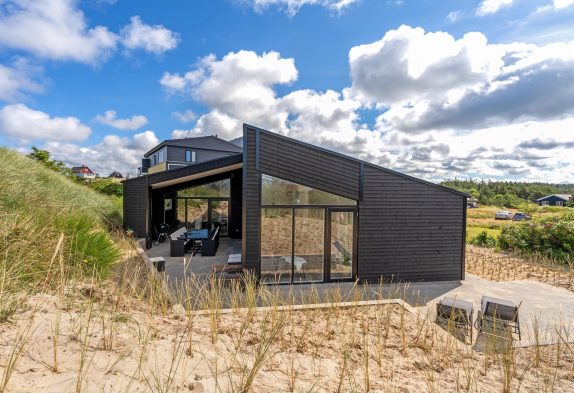
You are a GUI agent. You are given a task and a screenshot of the screen. Output one action in this format:
    pyautogui.click(x=<x>, y=<y>)
    Task: Click on the bench
    The height and width of the screenshot is (393, 574).
    Given the screenshot: What is the action you would take?
    pyautogui.click(x=227, y=268)